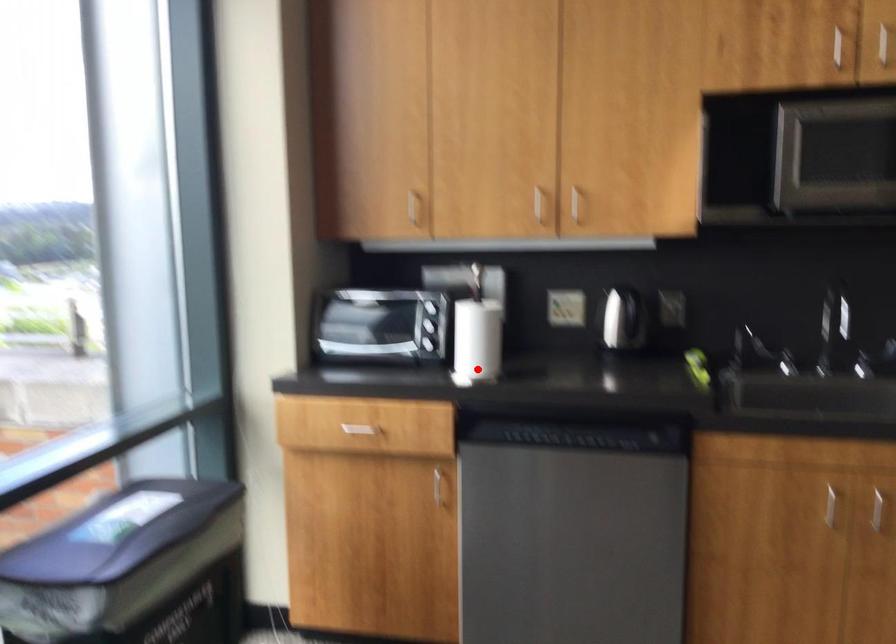
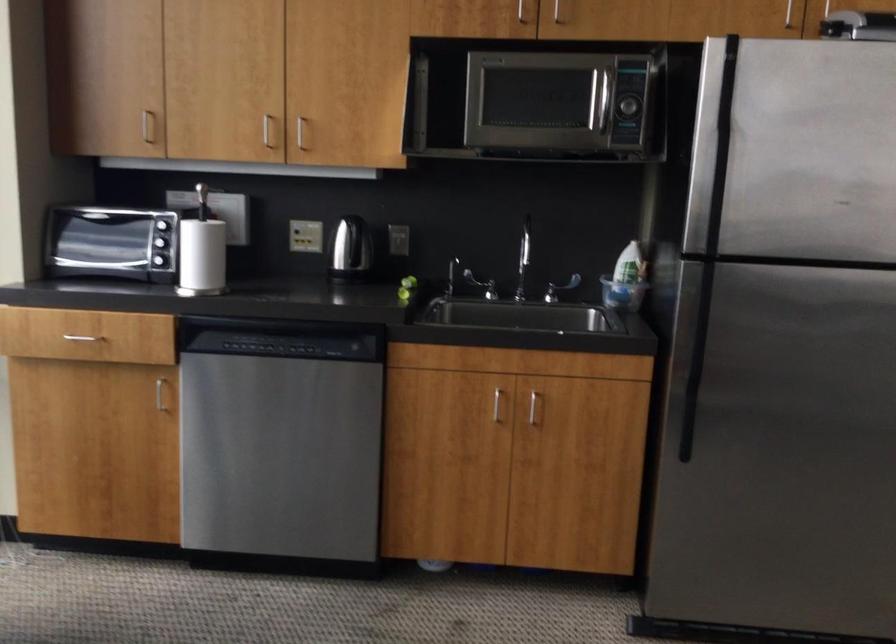
The point at the highlighted location is marked in the first image. Where is the corresponding point in the second image?

(202, 281)